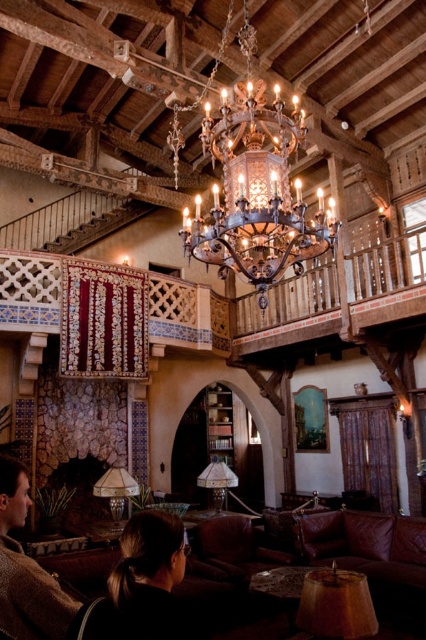
Question: Which object is closer to the camera taking this photo?

Choices:
 (A) brown wool sweater at lower left
 (B) antique brass chandelier at center
 (C) dark brown leather hair at center

Answer: (C)

Question: Which object is the closest to the brown wool sweater at lower left?

Choices:
 (A) dark brown leather hair at center
 (B) antique brass chandelier at center

Answer: (A)

Question: Does dark brown leather hair at center have a smaller size compared to brown wool sweater at lower left?

Choices:
 (A) yes
 (B) no

Answer: (A)

Question: Does antique brass chandelier at center appear over dark brown leather hair at center?

Choices:
 (A) no
 (B) yes

Answer: (B)

Question: Is antique brass chandelier at center bigger than dark brown leather hair at center?

Choices:
 (A) yes
 (B) no

Answer: (A)

Question: Among these objects, which one is farthest from the camera?

Choices:
 (A) antique brass chandelier at center
 (B) dark brown leather hair at center
 (C) brown wool sweater at lower left

Answer: (A)